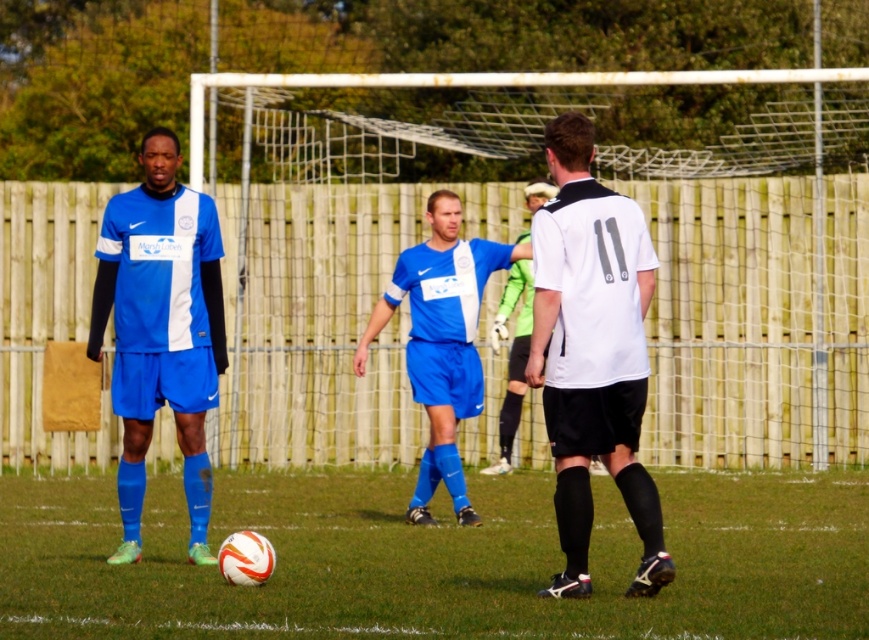
Question: Can you confirm if white matte soccer ball at center is wider than white matte jersey at center?

Choices:
 (A) yes
 (B) no

Answer: (A)

Question: Among these objects, which one is farthest from the camera?

Choices:
 (A) white matte soccer ball at center
 (B) matte blue soccer uniform at left
 (C) blue jersey at center
 (D) white matte jersey at center

Answer: (C)

Question: Which point is closer to the camera?

Choices:
 (A) (496, 339)
 (B) (549, 333)
 (C) (454, 353)
 (D) (576, 490)

Answer: (D)

Question: Which is farther from the white matte soccer ball at center?

Choices:
 (A) white matte jersey at center
 (B) blue jersey at center
 (C) matte blue soccer uniform at left
 (D) matte blue jersey at left

Answer: (C)

Question: Does matte blue jersey at left have a smaller size compared to blue jersey at center?

Choices:
 (A) no
 (B) yes

Answer: (A)

Question: From the image, what is the correct spatial relationship of white matte soccer ball at center in relation to matte blue soccer uniform at left?

Choices:
 (A) left
 (B) right

Answer: (A)